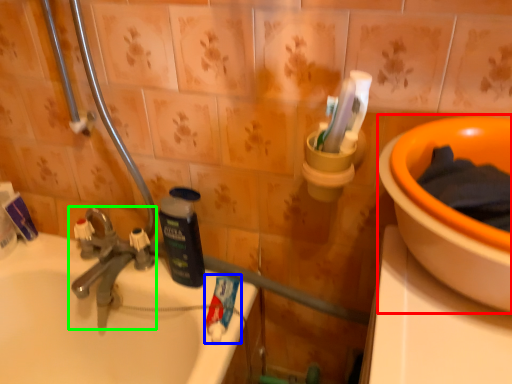
Question: Which object is the closest to the basin (highlighted by a red box)? Choose among these: toothpaste (highlighted by a blue box) or tap (highlighted by a green box).

Choices:
 (A) toothpaste
 (B) tap

Answer: (A)